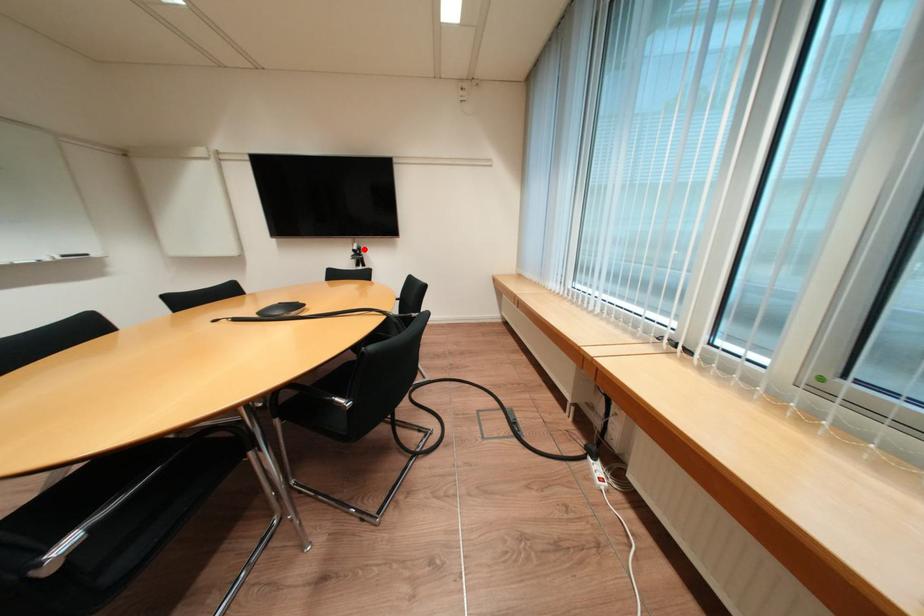
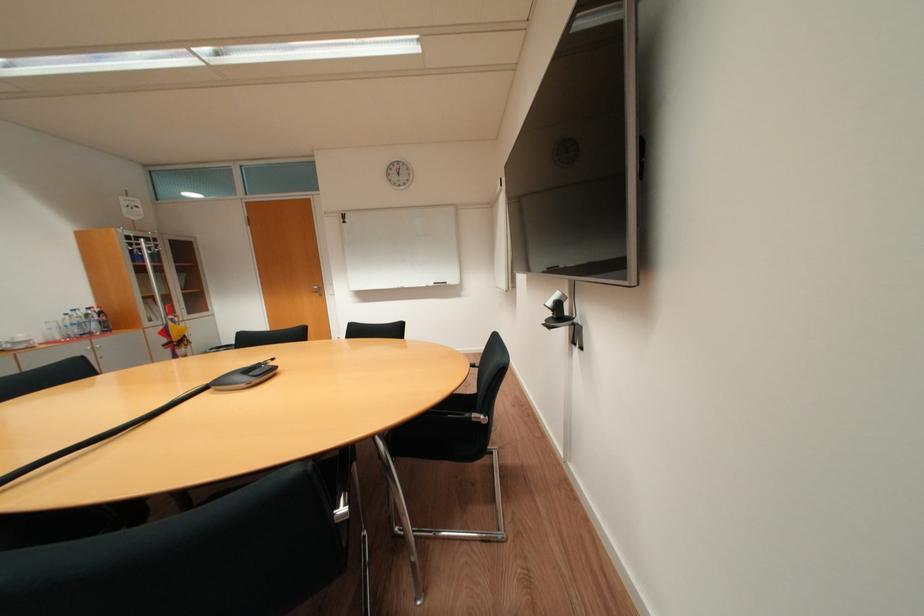
Locate, in the second image, the point that corresponds to the highlighted location in the first image.

(558, 304)